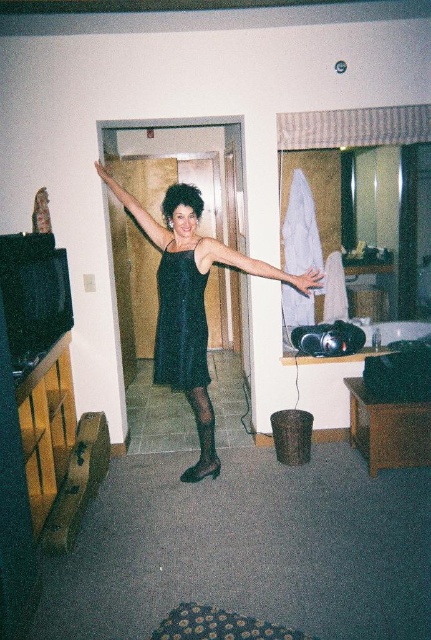
You are a photographer setting up a shoot in this hotel room. You need to position a light source so that it illuminates the black satin dress at center without affecting the black satin dress at upper center. Based on their positions, where should you place the light?

The black satin dress at center is in front of the black satin dress at upper center. To illuminate the black satin dress at center without affecting the other, position the light source in front of the black satin dress at center so that the light hits it directly while the black satin dress at upper center remains in shadow behind it.

You are a photographer positioned in front of the black sequined dress at center. You need to capture a closeup shot of the dress. Considering your current distance, can you move closer to achieve the desired shot?

The black sequined dress at center is 10.39 feet away from the viewer. To capture a closeup shot, you would need to move closer than 10.39 feet. However, since you are currently at that distance, you can move slightly closer to achieve the desired closeup.